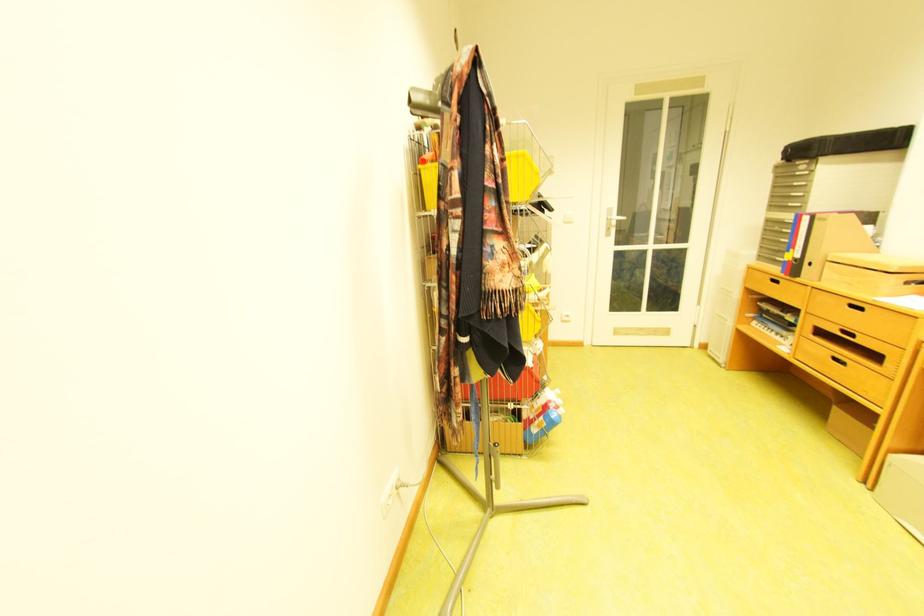
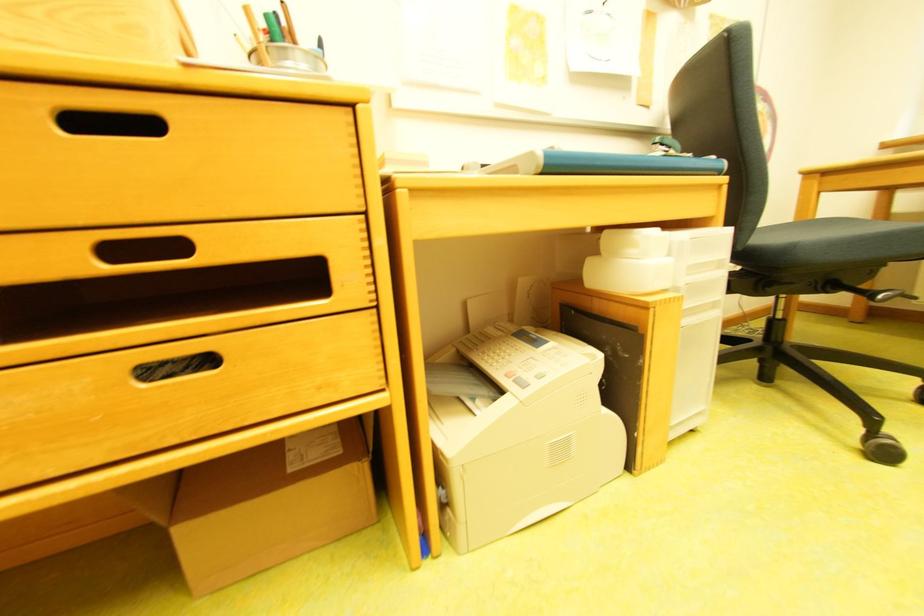
Locate, in the second image, the point that corresponds to pixel 845 360 in the first image.

(162, 374)